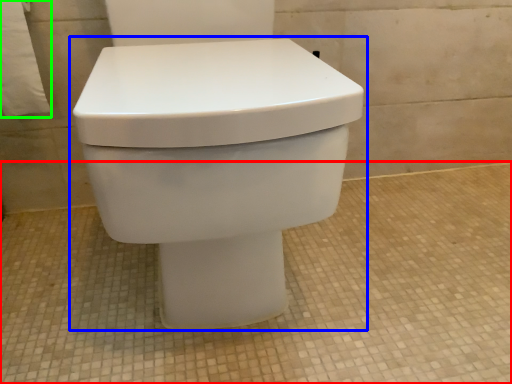
Question: Considering the real-world distances, which object is farthest from concrete (highlighted by a red box)? toilet (highlighted by a blue box) or toilet paper (highlighted by a green box)?

Choices:
 (A) toilet
 (B) toilet paper

Answer: (B)